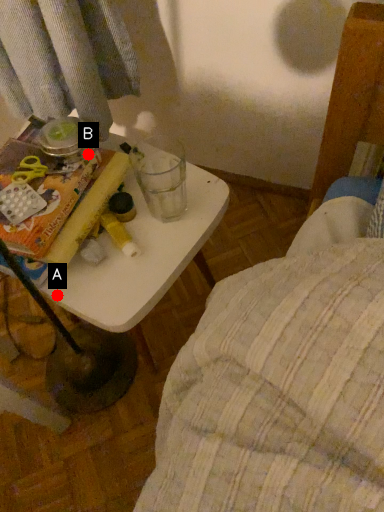
Question: Two points are circled on the image, labeled by A and B beside each circle. Which point appears farthest from the camera in this image?

Choices:
 (A) A is further
 (B) B is further

Answer: (B)